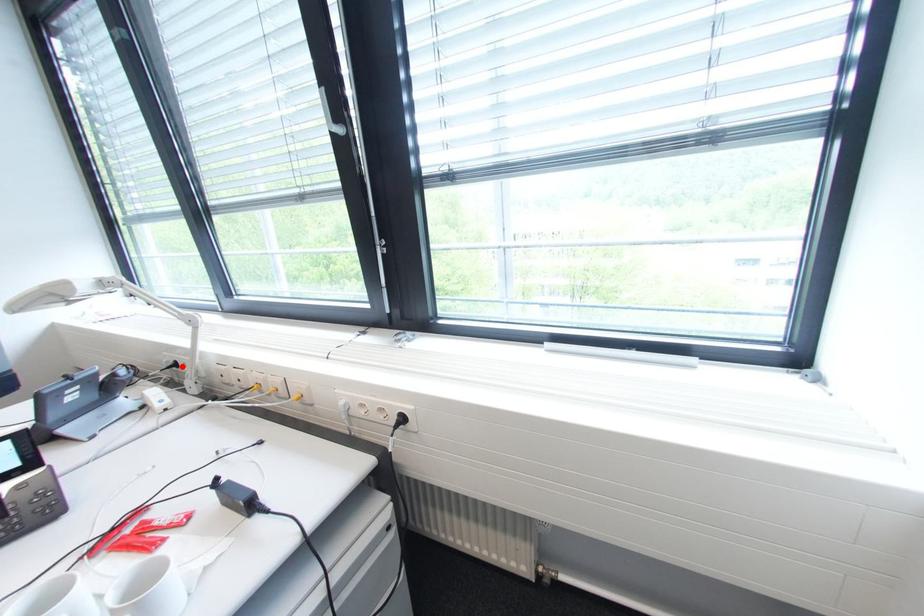
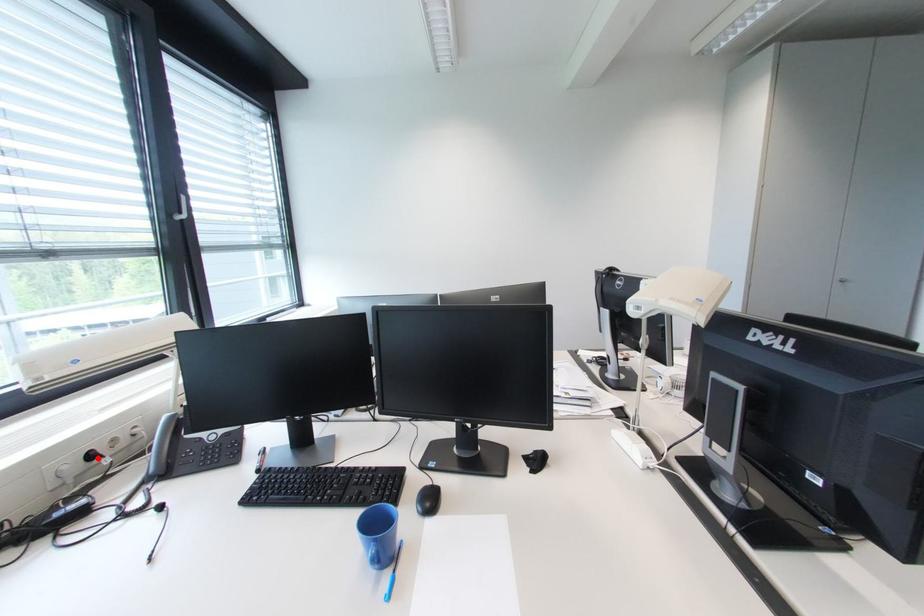
I am providing you with two images of the same scene from different viewpoints. A red point is marked on the first image and another point is marked on the second image. Do the highlighted points in image1 and image2 indicate the same real-world spot?

Yes